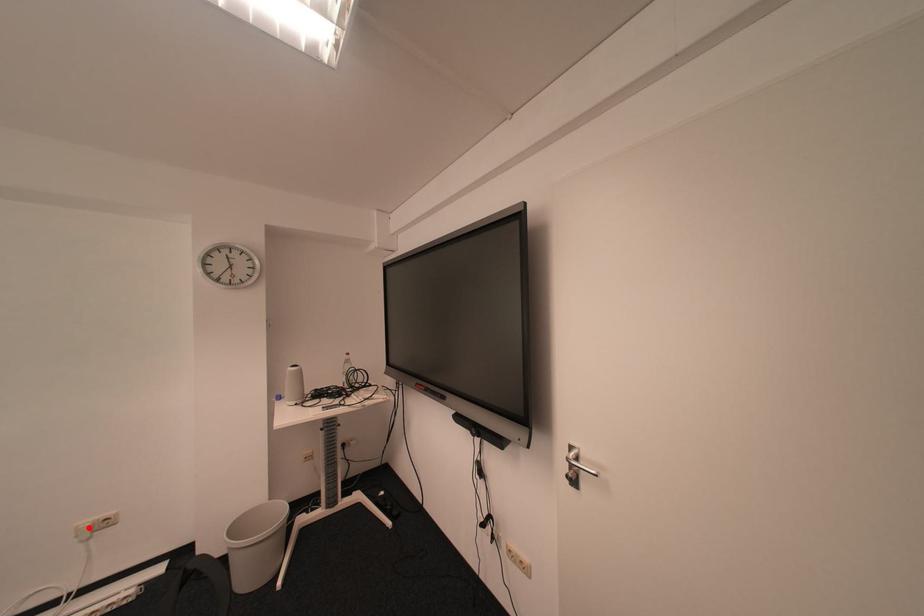
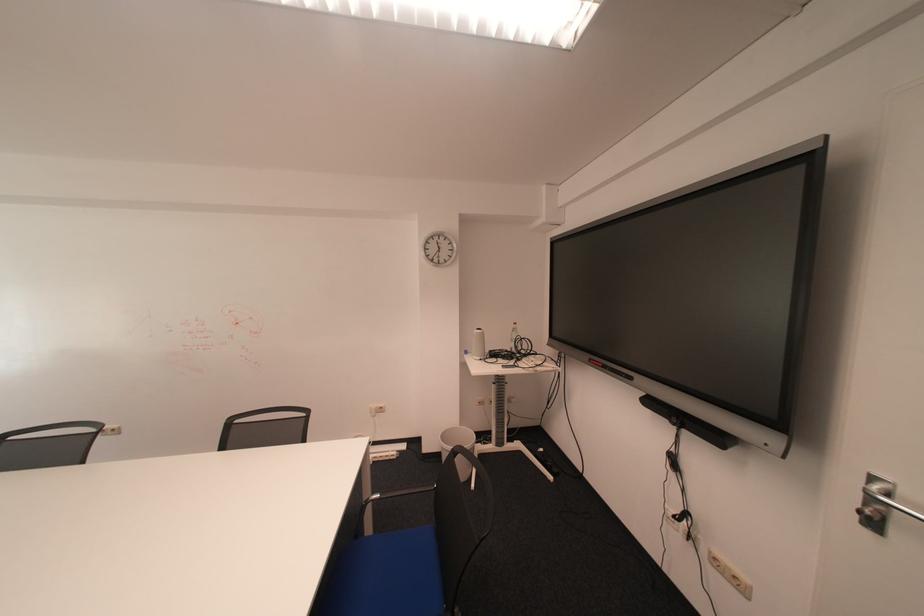
Question: I am providing you with two images of the same scene from different viewpoints. Given a red point in image1, look at the same physical point in image2. Is it:

Choices:
 (A) Closer to the viewpoint
 (B) Farther from the viewpoint

Answer: (A)